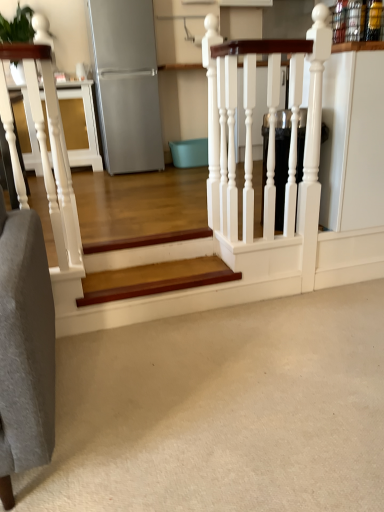
Question: Do you think satin silver refrigerator at upper left is within white carpet at lower center, or outside of it?

Choices:
 (A) outside
 (B) inside

Answer: (A)

Question: Is satin silver refrigerator at upper left taller or shorter than white carpet at lower center?

Choices:
 (A) tall
 (B) short

Answer: (A)

Question: Estimate the real-world distances between objects in this image. Which object is closer to the white glossy rail at upper center?

Choices:
 (A) wooden stair at center
 (B) white carpet at lower center
 (C) satin silver refrigerator at upper left

Answer: (A)

Question: Estimate the real-world distances between objects in this image. Which object is closer to the white carpet at lower center?

Choices:
 (A) white glossy rail at upper center
 (B) satin silver refrigerator at upper left
 (C) wooden stair at center

Answer: (C)